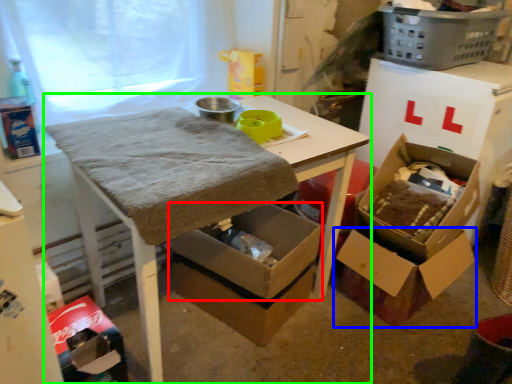
Question: Which is farther away from box (highlighted by a red box)? box (highlighted by a blue box) or table (highlighted by a green box)?

Choices:
 (A) box
 (B) table

Answer: (A)